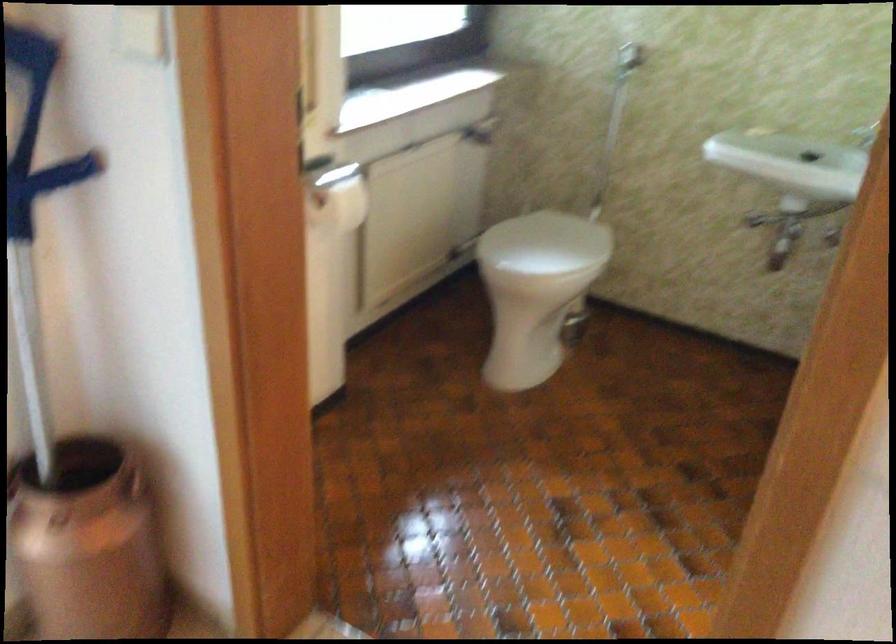
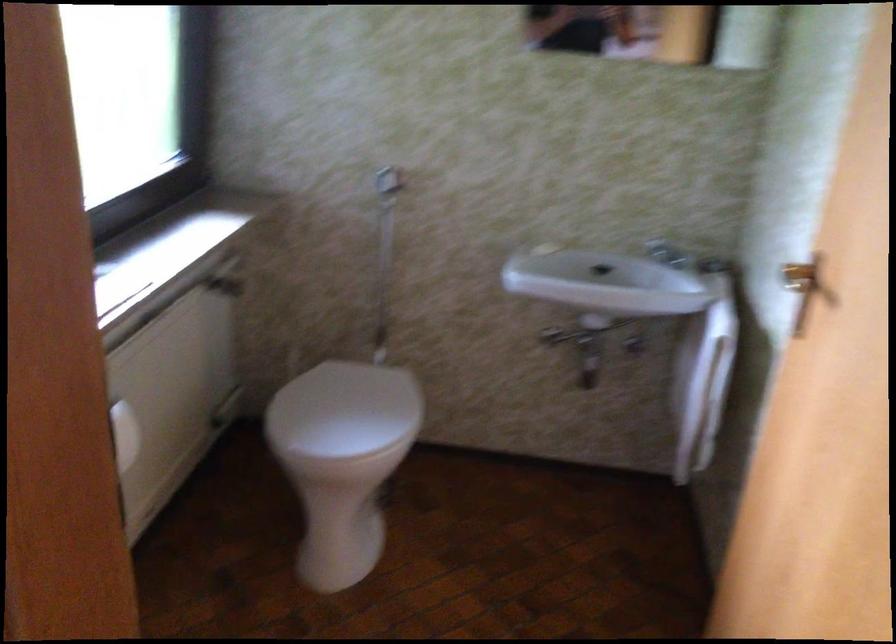
Question: The camera is either moving clockwise (left) or counter-clockwise (right) around the object. The first image is from the beginning of the video and the second image is from the end. Is the camera moving left or right when shooting the video?

Choices:
 (A) Left
 (B) Right

Answer: (A)